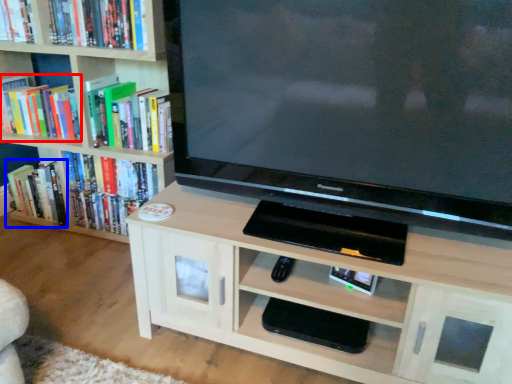
Question: Which object is further to the camera taking this photo, book (highlighted by a red box) or book (highlighted by a blue box)?

Choices:
 (A) book
 (B) book

Answer: (B)